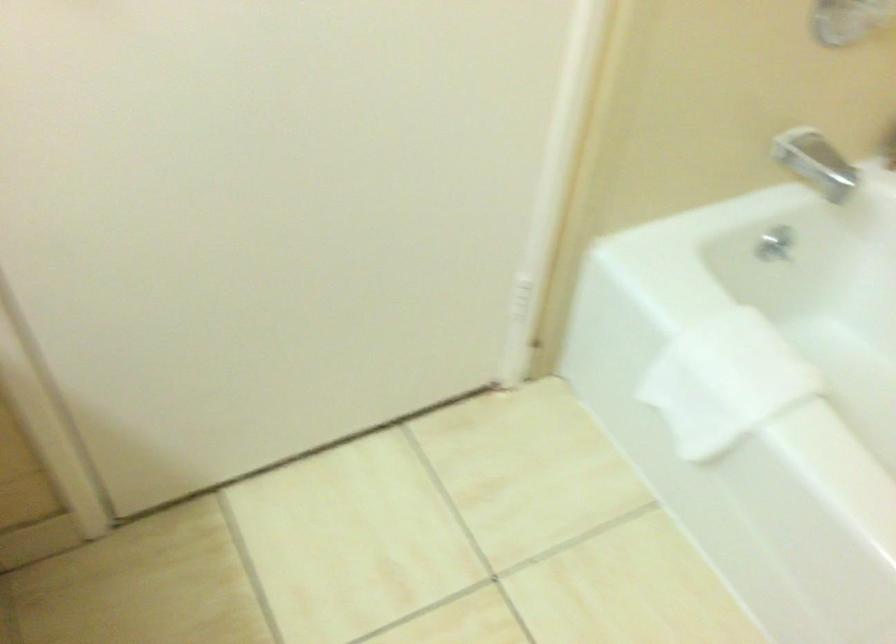
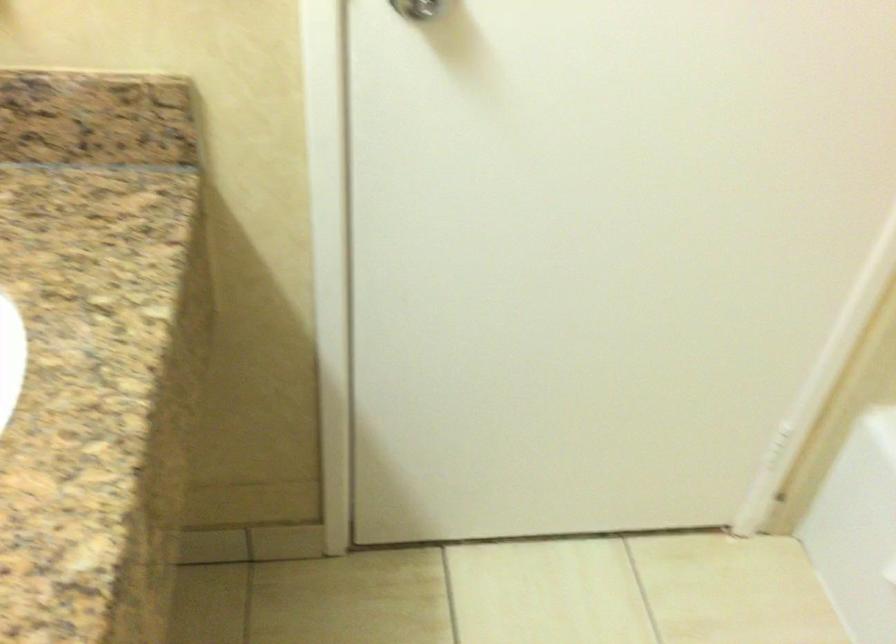
In a continuous first-person perspective shot, in which direction is the camera moving?

The cameraman moved toward left, backward.